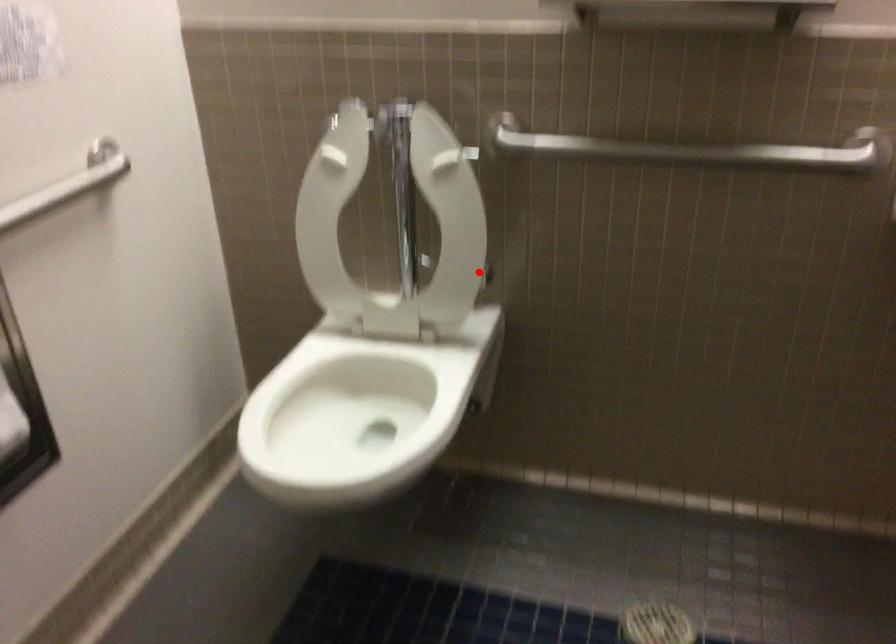
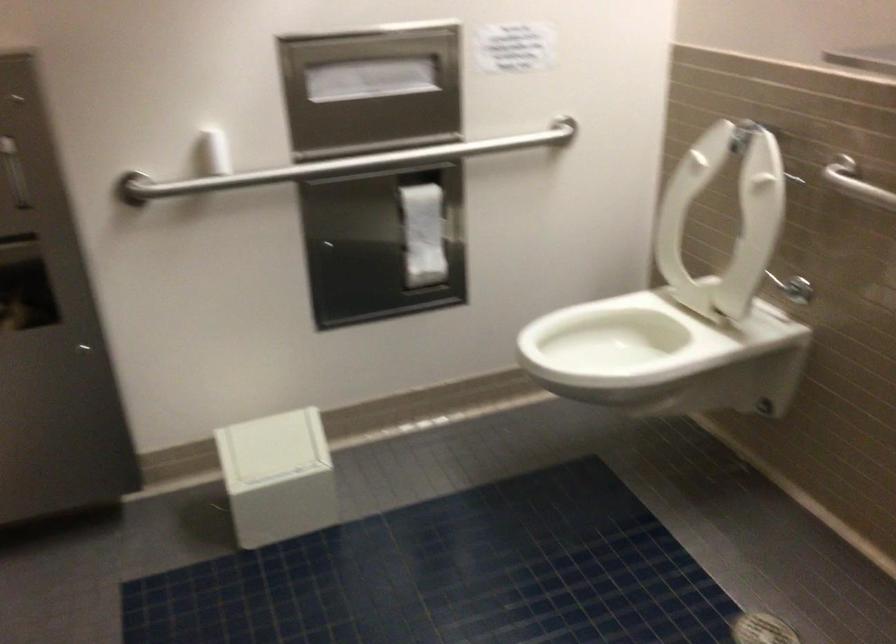
Question: I am providing you with two images of the same scene from different viewpoints. Given a red point in image1, look at the same physical point in image2. Is it:

Choices:
 (A) Closer to the viewpoint
 (B) Farther from the viewpoint

Answer: (B)